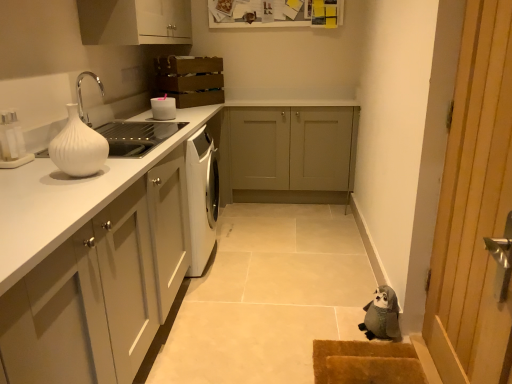
Question: From a real-world perspective, is white glossy vase at left below white glossy countertop at left?

Choices:
 (A) yes
 (B) no

Answer: (B)

Question: From the image's perspective, is white glossy vase at left on top of white glossy countertop at left?

Choices:
 (A) yes
 (B) no

Answer: (A)

Question: Does white glossy vase at left appear on the right side of white glossy countertop at left?

Choices:
 (A) yes
 (B) no

Answer: (B)

Question: Considering the relative sizes of white glossy vase at left and white glossy countertop at left in the image provided, is white glossy vase at left taller than white glossy countertop at left?

Choices:
 (A) no
 (B) yes

Answer: (A)

Question: From a real-world perspective, is white glossy vase at left over white glossy countertop at left?

Choices:
 (A) yes
 (B) no

Answer: (A)

Question: Would you consider white glossy vase at left to be distant from white glossy countertop at left?

Choices:
 (A) yes
 (B) no

Answer: (B)

Question: Could you tell me if white glossy countertop at left is turned towards brown textured mat at lower right?

Choices:
 (A) no
 (B) yes

Answer: (A)

Question: Can brown textured mat at lower right be found inside white glossy countertop at left?

Choices:
 (A) yes
 (B) no

Answer: (B)

Question: Is white glossy countertop at left to the left of brown textured mat at lower right from the viewer's perspective?

Choices:
 (A) no
 (B) yes

Answer: (B)

Question: Is white glossy countertop at left positioned before brown textured mat at lower right?

Choices:
 (A) no
 (B) yes

Answer: (A)

Question: Considering the relative sizes of white glossy countertop at left and brown textured mat at lower right in the image provided, is white glossy countertop at left smaller than brown textured mat at lower right?

Choices:
 (A) yes
 (B) no

Answer: (B)

Question: Considering the relative positions of white glossy countertop at left and brown textured mat at lower right in the image provided, is white glossy countertop at left to the right of brown textured mat at lower right from the viewer's perspective?

Choices:
 (A) yes
 (B) no

Answer: (B)

Question: Is gray fabric stuffed animal at lower right a part of brown textured mat at lower right?

Choices:
 (A) no
 (B) yes

Answer: (A)